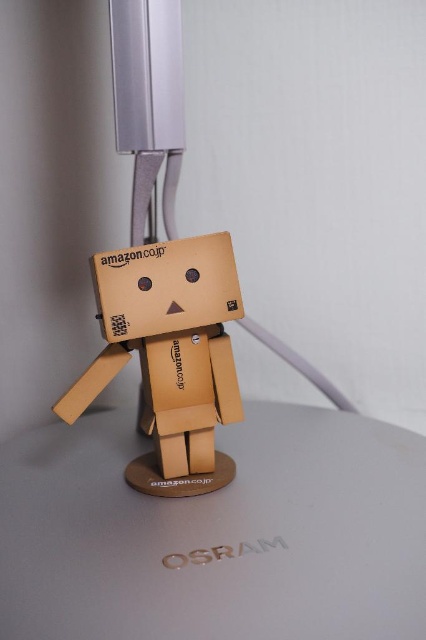
Does point (367, 486) lie in front of point (238, 413)?

Yes, point (367, 486) is closer to viewer.

Between matte gray table at center and matte cardboard figure at center, which one appears on the right side from the viewer's perspective?

From the viewer's perspective, matte gray table at center appears more on the right side.

Between point (121, 557) and point (146, 340), which one is positioned in front?

Point (121, 557) is more forward.

This screenshot has width=426, height=640. What are the coordinates of `matte gray table at center` in the screenshot? It's located at (216, 532).